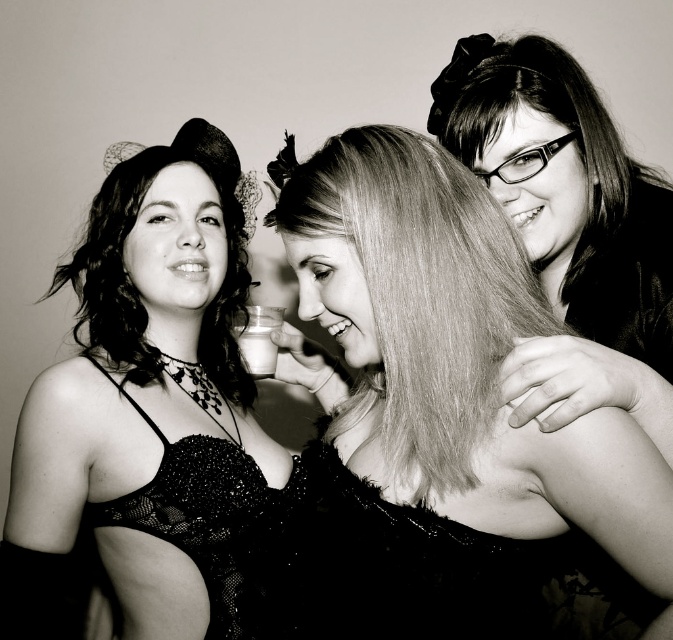
Question: Which of the following is the closest to the observer?

Choices:
 (A) [x=458, y=65]
 (B) [x=406, y=184]
 (C) [x=211, y=177]

Answer: (B)

Question: Is smooth hair at center positioned at the back of translucent glass at center?

Choices:
 (A) no
 (B) yes

Answer: (A)

Question: Which of the following is the closest to the observer?

Choices:
 (A) (378, 592)
 (B) (116, 596)
 (C) (631, 208)

Answer: (A)

Question: Where is black sequined dress at center located in relation to black lace dress at center in the image?

Choices:
 (A) above
 (B) below

Answer: (B)

Question: Can you confirm if matte black lace dress at left is positioned to the left of translucent glass at center?

Choices:
 (A) no
 (B) yes

Answer: (B)

Question: Which of the following is the closest to the observer?

Choices:
 (A) (215, 346)
 (B) (269, 310)
 (C) (310, 516)
 (D) (616, 541)

Answer: (D)